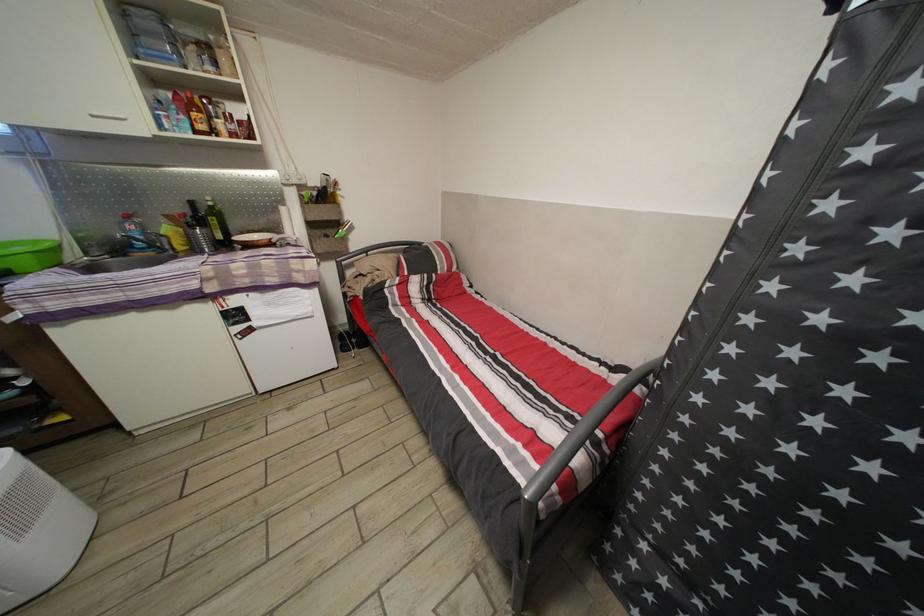
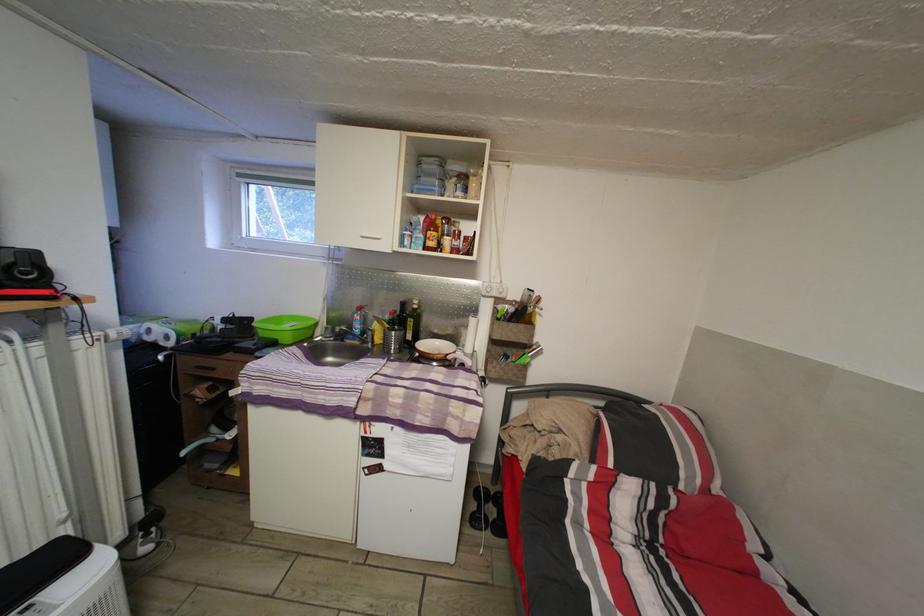
In the second image, find the point that corresponds to [226,243] in the first image.

(417, 344)